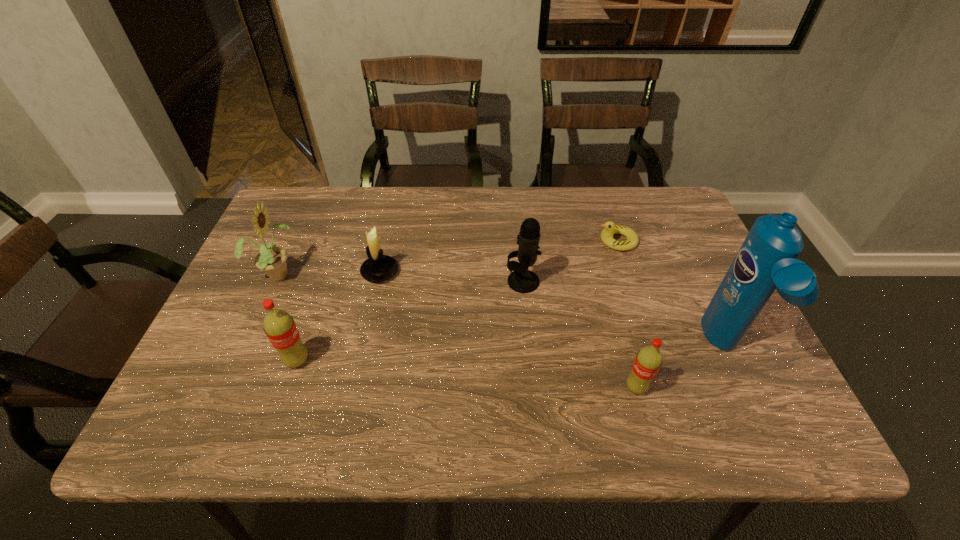
Image resolution: width=960 pixels, height=540 pixels. Identify the location of the left soda. (279, 326).

The image size is (960, 540). In order to click on the sixth object from right to left in this screenshot , I will do `click(279, 326)`.

Identify the location of the nearer soda. The image size is (960, 540). (648, 361).

This screenshot has height=540, width=960. I want to click on the shorter soda, so click(648, 361).

Find the location of a particular element. Image resolution: width=960 pixels, height=540 pixels. the fourth object from left to right is located at coordinates (521, 280).

The image size is (960, 540). In order to click on duckling in this screenshot , I will do `click(610, 228)`.

Where is `the farthest object`? This screenshot has height=540, width=960. the farthest object is located at coordinates (610, 228).

This screenshot has width=960, height=540. Find the location of `the fifth object from right to left`. the fifth object from right to left is located at coordinates (377, 268).

This screenshot has width=960, height=540. In order to click on sunflower in this screenshot , I will do `click(272, 260)`.

This screenshot has width=960, height=540. Identify the location of the rightmost object. (767, 260).